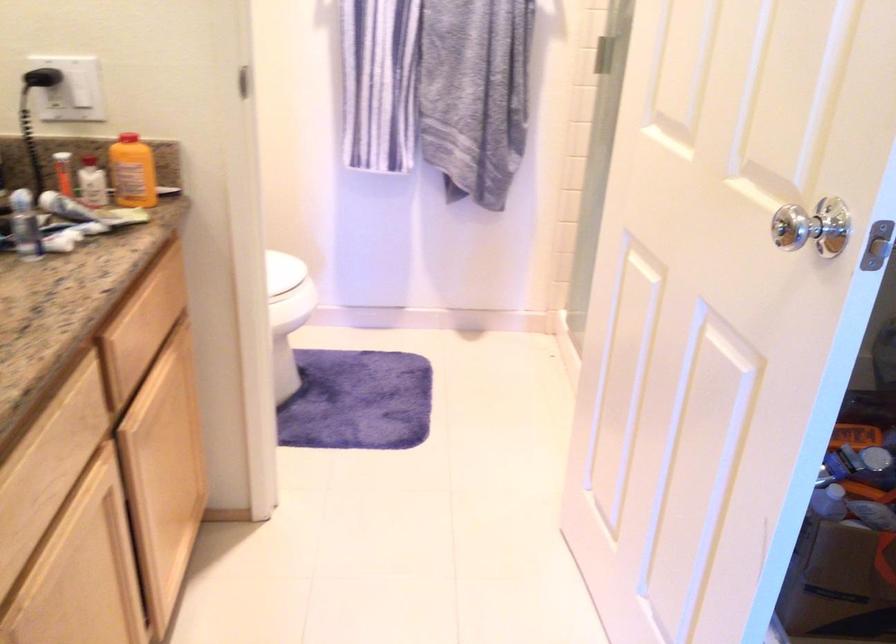
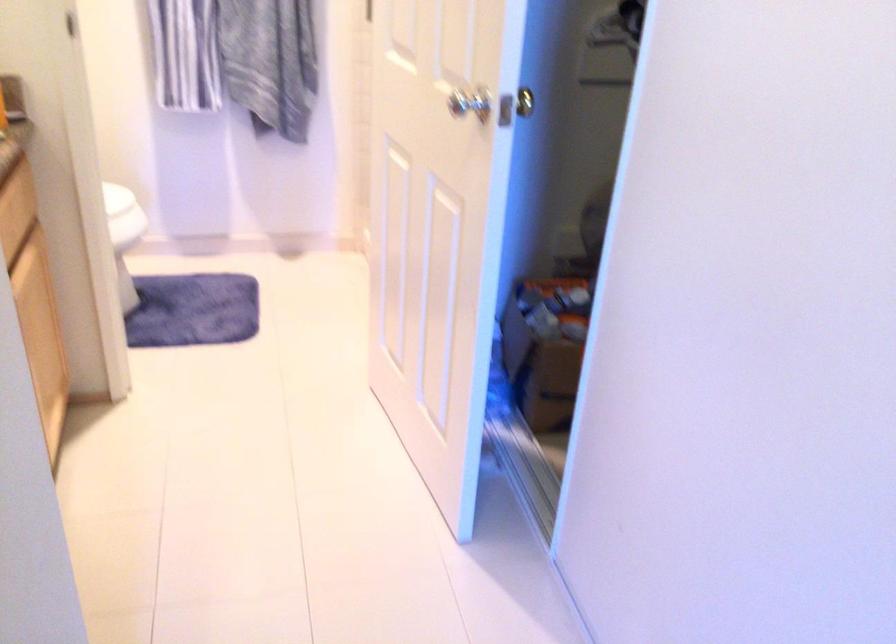
Question: How did the camera likely rotate?

Choices:
 (A) Left
 (B) Right
 (C) Up
 (D) Down

Answer: (B)